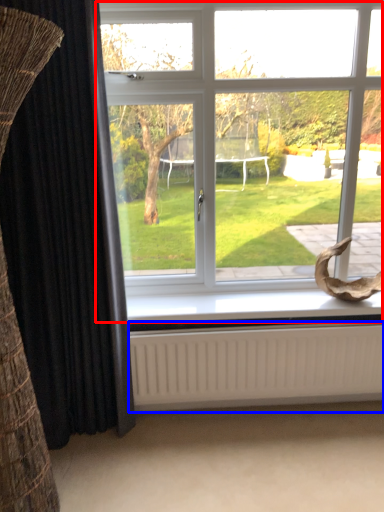
Question: Which object is closer to the camera taking this photo, window (highlighted by a red box) or radiator (highlighted by a blue box)?

Choices:
 (A) window
 (B) radiator

Answer: (A)